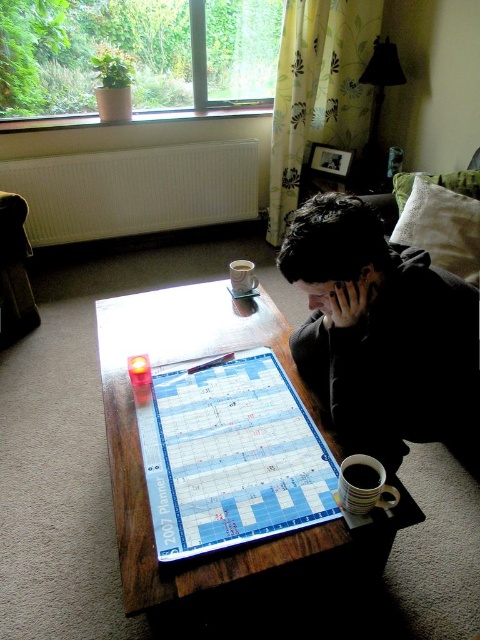
You are standing in the living room and see two points marked in the image. Which point is closer to you, point (279, 259) or point (208, 536)?

Point (279, 259) is closer to you because it is further to the viewer than point (208, 536).

You are organizing your workspace and need to place the blue plastic planner at center on top of the wooden table at center. Can you do this without the planner being too thick to fit on the table?

The blue plastic planner at center is thinner than the wooden table at center, so it can be placed on top without any issues related to thickness.